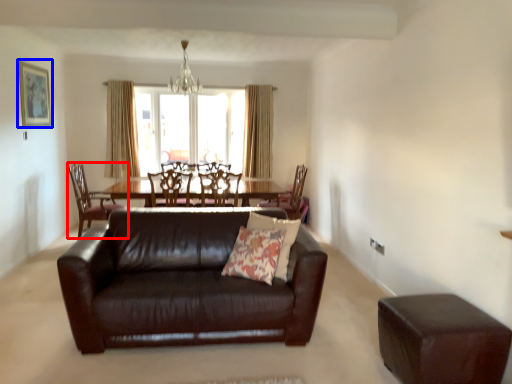
Question: Which of the following is the closest to the observer, chair (highlighted by a red box) or picture frame (highlighted by a blue box)?

Choices:
 (A) chair
 (B) picture frame

Answer: (B)